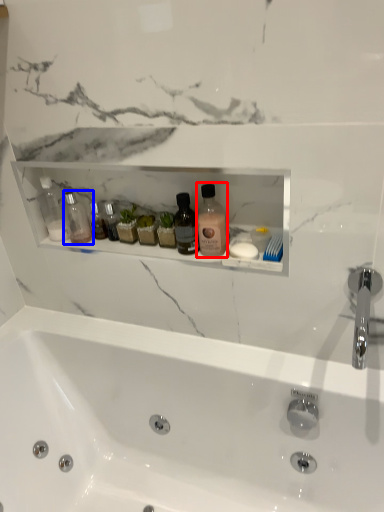
Question: Among these objects, which one is nearest to the camera, cleaning product (highlighted by a red box) or toiletry (highlighted by a blue box)?

Choices:
 (A) cleaning product
 (B) toiletry

Answer: (A)